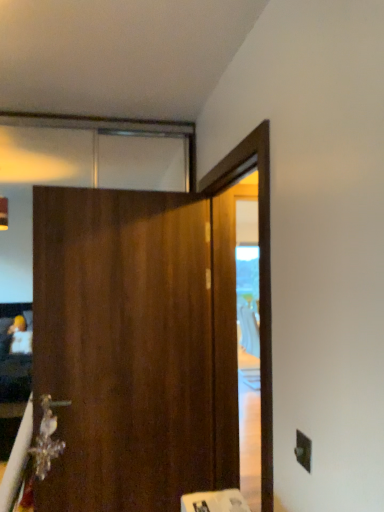
Measure the distance between point (x=42, y=467) and camera.

Point (x=42, y=467) and camera are 6.70 feet apart.

Identify the location of black plastic electric outlet at lower right. [x=303, y=450].

Identify the location of wooden barn door at center. (123, 346).

Identify the location of metallic crystal at lower left. The width and height of the screenshot is (384, 512). (47, 438).

What's the angular difference between black plastic electric outlet at lower right and wooden barn door at center's facing directions?

The angular difference between black plastic electric outlet at lower right and wooden barn door at center is 94.1 degrees.

Considering the sizes of black plastic electric outlet at lower right and wooden barn door at center in the image, is black plastic electric outlet at lower right bigger or smaller than wooden barn door at center?

In the image, black plastic electric outlet at lower right appears to be smaller than wooden barn door at center.

Is black plastic electric outlet at lower right positioned behind wooden barn door at center?

No, black plastic electric outlet at lower right is closer to the viewer.

Is black plastic electric outlet at lower right wider or thinner than wooden barn door at center?

black plastic electric outlet at lower right is thinner than wooden barn door at center.

Is metallic crystal at lower left spatially inside wooden barn door at center, or outside of it?

metallic crystal at lower left lies within the bounds of wooden barn door at center.

Which object is further away from the camera taking this photo, metallic crystal at lower left or wooden barn door at center?

metallic crystal at lower left is further away from the camera.

Is metallic crystal at lower left bigger than wooden barn door at center?

Incorrect, metallic crystal at lower left is not larger than wooden barn door at center.

Considering the sizes of objects metallic crystal at lower left and wooden barn door at center in the image provided, who is wider, metallic crystal at lower left or wooden barn door at center?

wooden barn door at center is wider.

What's the angular difference between black plastic electric outlet at lower right and metallic crystal at lower left's facing directions?

The angular difference between black plastic electric outlet at lower right and metallic crystal at lower left is 94.4 degrees.

In the scene shown: Which is farther from the camera, (x=308, y=460) or (x=50, y=418)?

Positioned behind is point (x=50, y=418).

Which of these two, black plastic electric outlet at lower right or metallic crystal at lower left, is thinner?

Thinner between the two is black plastic electric outlet at lower right.

Is the surface of black plastic electric outlet at lower right in direct contact with metallic crystal at lower left?

No, black plastic electric outlet at lower right is not in contact with metallic crystal at lower left.

From the image's perspective, which one is positioned higher, wooden barn door at center or metallic crystal at lower left?

wooden barn door at center.

Is wooden barn door at center not within metallic crystal at lower left?

Yes, wooden barn door at center is not within metallic crystal at lower left.

Which object is positioned more to the right, wooden barn door at center or metallic crystal at lower left?

Positioned to the right is wooden barn door at center.

How different are the orientations of wooden barn door at center and metallic crystal at lower left in degrees?

The angular difference between wooden barn door at center and metallic crystal at lower left is 0.272 degrees.

From a real-world perspective, is wooden barn door at center under black plastic electric outlet at lower right?

No, from a real-world perspective, wooden barn door at center is not beneath black plastic electric outlet at lower right.

Does wooden barn door at center turn towards black plastic electric outlet at lower right?

Yes, wooden barn door at center faces towards black plastic electric outlet at lower right.

From the image's perspective, between wooden barn door at center and black plastic electric outlet at lower right, who is located below?

black plastic electric outlet at lower right.

Can you see metallic crystal at lower left touching black plastic electric outlet at lower right?

No, metallic crystal at lower left is not with black plastic electric outlet at lower right.

Considering the sizes of metallic crystal at lower left and black plastic electric outlet at lower right in the image, is metallic crystal at lower left bigger or smaller than black plastic electric outlet at lower right?

metallic crystal at lower left is bigger than black plastic electric outlet at lower right.

Is black plastic electric outlet at lower right inside metallic crystal at lower left?

No, black plastic electric outlet at lower right is not surrounded by metallic crystal at lower left.

Does metallic crystal at lower left have a greater width compared to black plastic electric outlet at lower right?

Yes, metallic crystal at lower left is wider than black plastic electric outlet at lower right.

Locate an element on the screen. barn door behind the black plastic electric outlet at lower right is located at coordinates (123, 346).

This screenshot has width=384, height=512. Find the location of `door handle below the wooden barn door at center (from the image's perspective)`. door handle below the wooden barn door at center (from the image's perspective) is located at coordinates pyautogui.click(x=47, y=438).

Consider the image. From the image, which object appears to be nearer to black plastic electric outlet at lower right, metallic crystal at lower left or wooden barn door at center?

Among the two, wooden barn door at center is located nearer to black plastic electric outlet at lower right.

Considering their positions, is wooden barn door at center positioned further to metallic crystal at lower left than black plastic electric outlet at lower right?

black plastic electric outlet at lower right is further to metallic crystal at lower left.

Considering their positions, is wooden barn door at center positioned closer to black plastic electric outlet at lower right than metallic crystal at lower left?

Among the two, wooden barn door at center is located nearer to black plastic electric outlet at lower right.

Looking at the image, which one is located closer to wooden barn door at center, black plastic electric outlet at lower right or metallic crystal at lower left?

metallic crystal at lower left.

From the image, which object appears to be farther from metallic crystal at lower left, black plastic electric outlet at lower right or wooden barn door at center?

Among the two, black plastic electric outlet at lower right is located further to metallic crystal at lower left.

Estimate the real-world distances between objects in this image. Which object is further from wooden barn door at center, metallic crystal at lower left or black plastic electric outlet at lower right?

black plastic electric outlet at lower right.

Find the location of `barn door situated between metallic crystal at lower left and black plastic electric outlet at lower right from left to right`. barn door situated between metallic crystal at lower left and black plastic electric outlet at lower right from left to right is located at coordinates (123, 346).